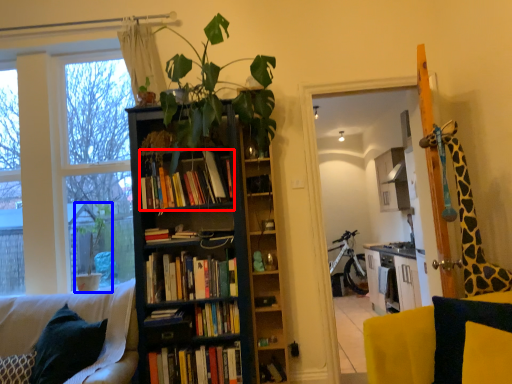
Question: Which object is closer to the camera taking this photo, book (highlighted by a red box) or houseplant (highlighted by a blue box)?

Choices:
 (A) book
 (B) houseplant

Answer: (A)